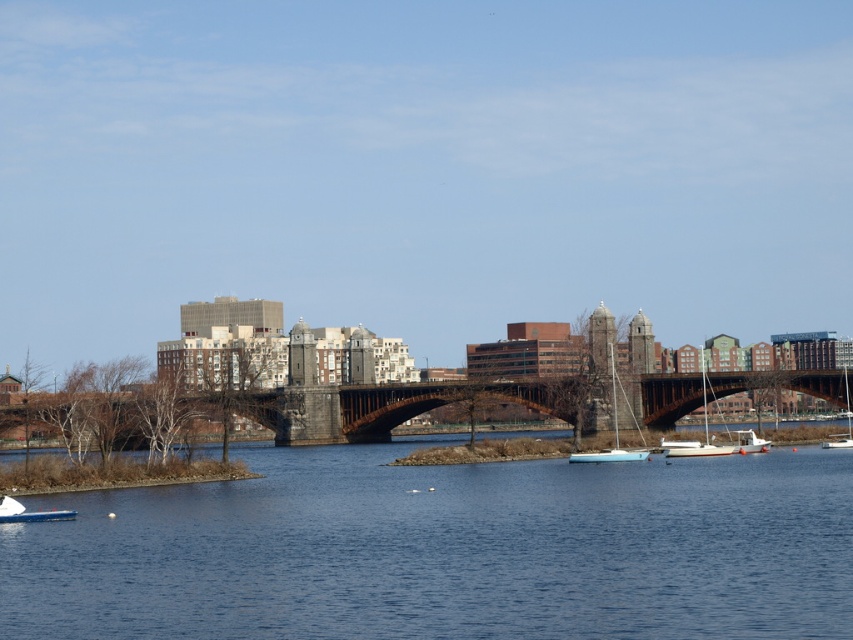
Question: Does dark brown stone bridge at center appear under blue glossy boat at lower left?

Choices:
 (A) yes
 (B) no

Answer: (B)

Question: Can you confirm if white matte sailboat at center is thinner than white glossy boat at center?

Choices:
 (A) no
 (B) yes

Answer: (A)

Question: Among these objects, which one is nearest to the camera?

Choices:
 (A) white matte sailboat at center
 (B) white matte boat at lower right
 (C) white glossy boat at center
 (D) white matte sailboat at center-right

Answer: (C)

Question: Considering the real-world distances, which object is farthest from the blue water at center?

Choices:
 (A) dark brown stone bridge at center
 (B) white matte boat at lower right

Answer: (B)

Question: Is blue glossy boat at lower left below white glossy boat at center?

Choices:
 (A) yes
 (B) no

Answer: (A)

Question: Among these objects, which one is farthest from the camera?

Choices:
 (A) white matte sailboat at center-right
 (B) white matte sailboat at center
 (C) dark brown stone bridge at center

Answer: (C)